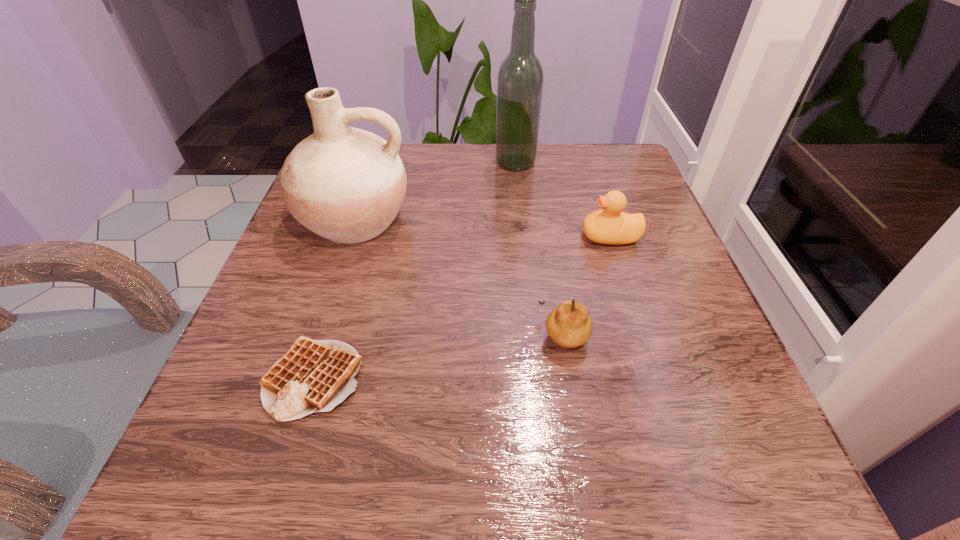
What are the coordinates of `free space that satisfies the following two spatial constraints: 1. on the front side of the pear; 2. on the left side of the liquor` in the screenshot? It's located at (534, 334).

Identify the location of vacant region that satisfies the following two spatial constraints: 1. to pour from the handle of the pear; 2. on the left side of the fourth shortest object. The height and width of the screenshot is (540, 960). (317, 334).